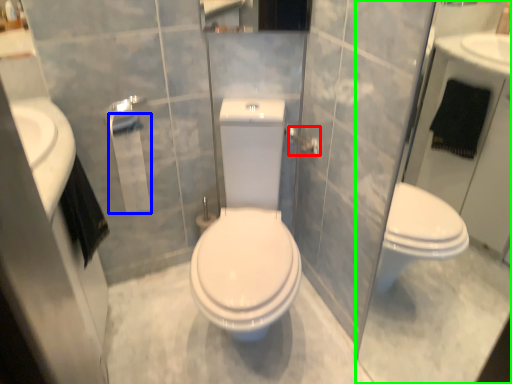
Question: Which object is positioned farthest from towel bar (highlighted by a red box)? Select from toilet paper (highlighted by a blue box) and glass door (highlighted by a green box).

Choices:
 (A) toilet paper
 (B) glass door

Answer: (B)